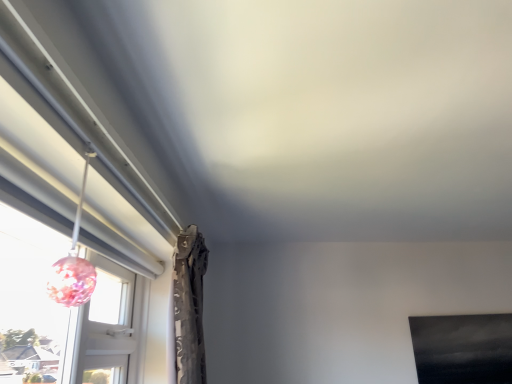
Where is `transparent glass window at left`? This screenshot has height=384, width=512. transparent glass window at left is located at coordinates (80, 225).

Image resolution: width=512 pixels, height=384 pixels. Describe the element at coordinates (80, 225) in the screenshot. I see `transparent glass window at left` at that location.

The height and width of the screenshot is (384, 512). In order to click on transparent glass window at left in this screenshot , I will do `click(80, 225)`.